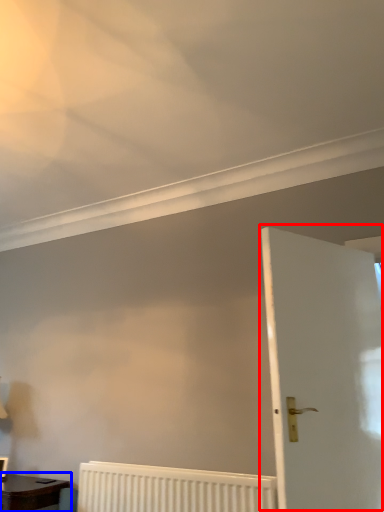
Question: Which object appears farthest to the camera in this image, door (highlighted by a red box) or table (highlighted by a blue box)?

Choices:
 (A) door
 (B) table

Answer: (B)